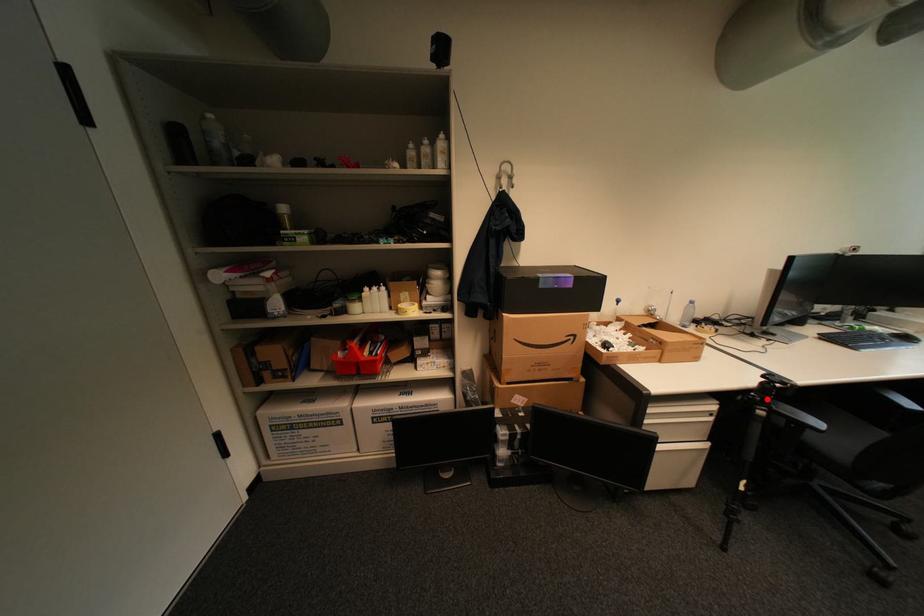
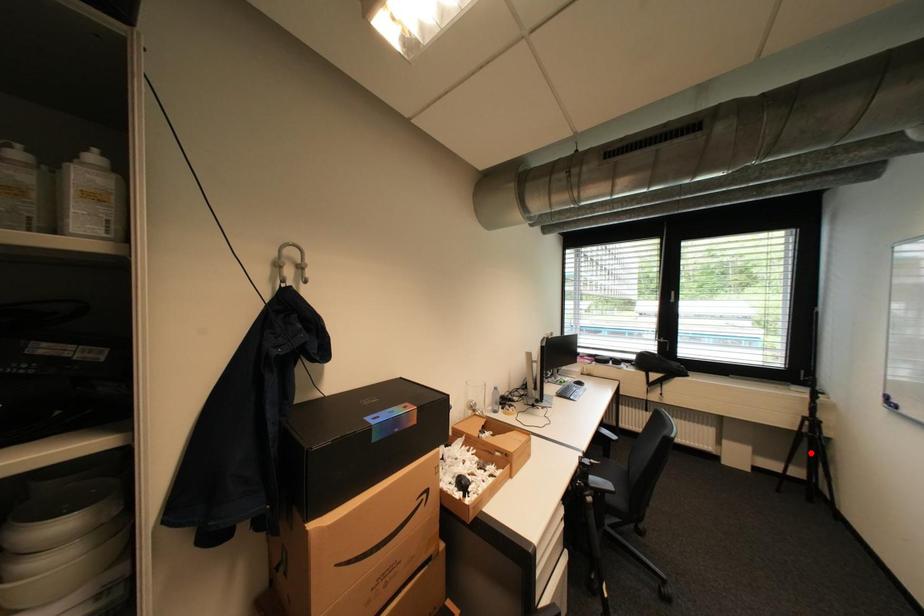
I am providing you with two images of the same scene from different viewpoints. A red point is marked on the first image and another point is marked on the second image. Does the point marked in image1 correspond to the same location as the one in image2?

No